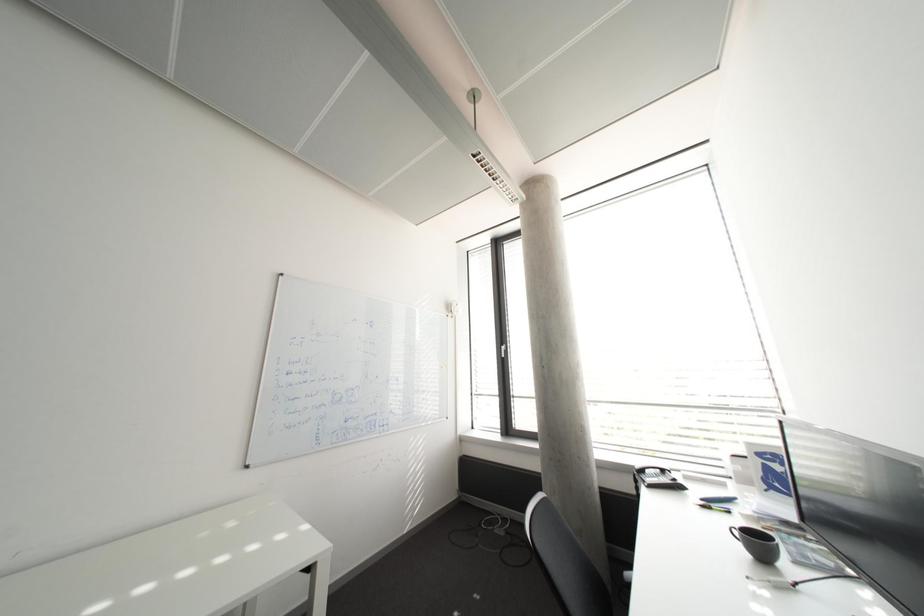
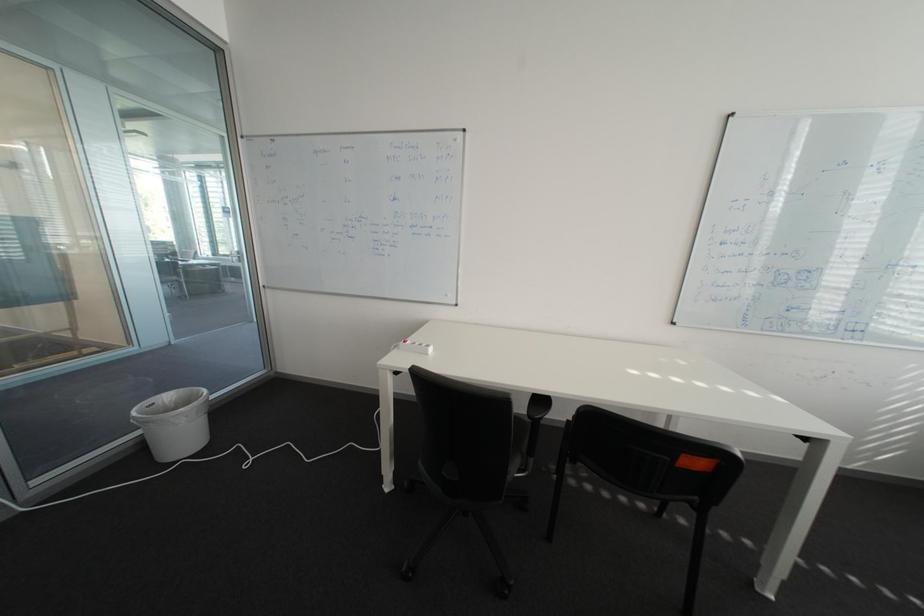
How did the camera likely rotate?

The camera rotated toward left-down.